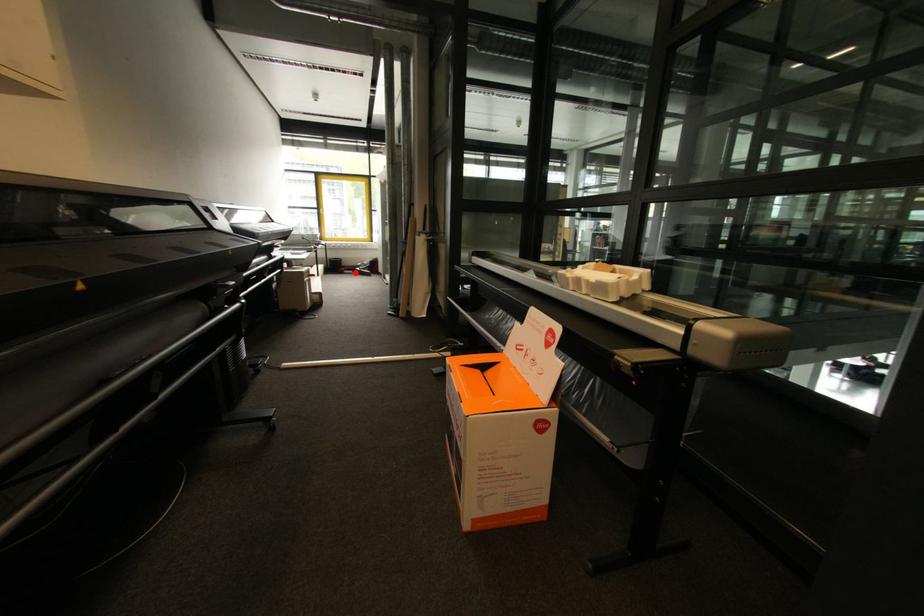
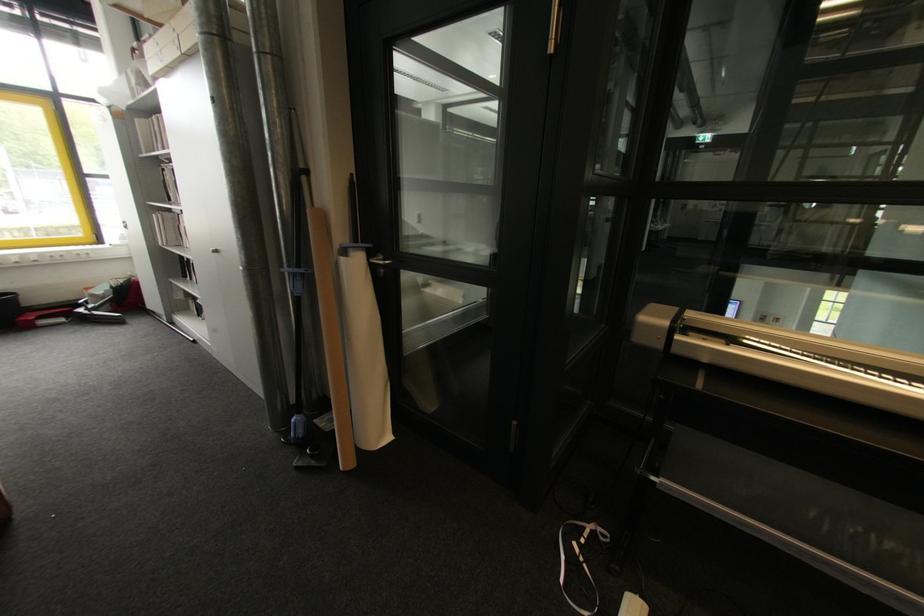
Question: I am providing you with two images of the same scene from different viewpoints. Given a red point in image1, look at the same physical point in image2. Is it:

Choices:
 (A) Closer to the viewpoint
 (B) Farther from the viewpoint

Answer: (B)